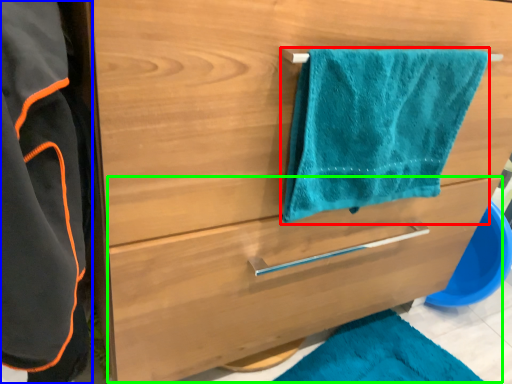
Question: Which is nearer to the towel/napkin (highlighted by a red box)? bathrobe (highlighted by a blue box) or drawer (highlighted by a green box).

Choices:
 (A) bathrobe
 (B) drawer

Answer: (B)